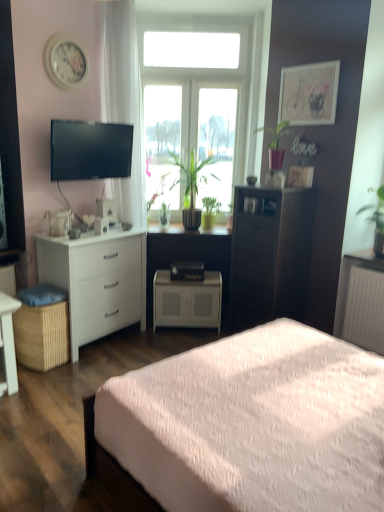
Locate an element on the screen. This screenshot has height=512, width=384. free spot to the right of brown woven picnic basket at lower left is located at coordinates click(81, 361).